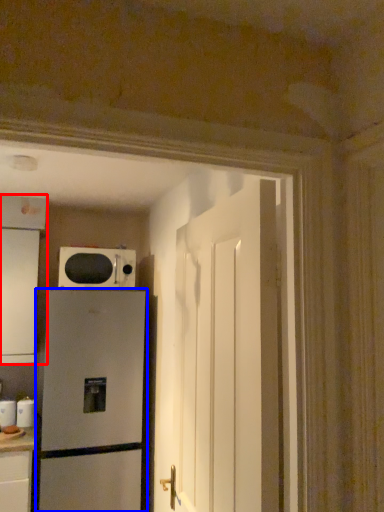
Question: Among these objects, which one is nearest to the camera, cabinetry (highlighted by a red box) or refrigerator (highlighted by a blue box)?

Choices:
 (A) cabinetry
 (B) refrigerator

Answer: (B)